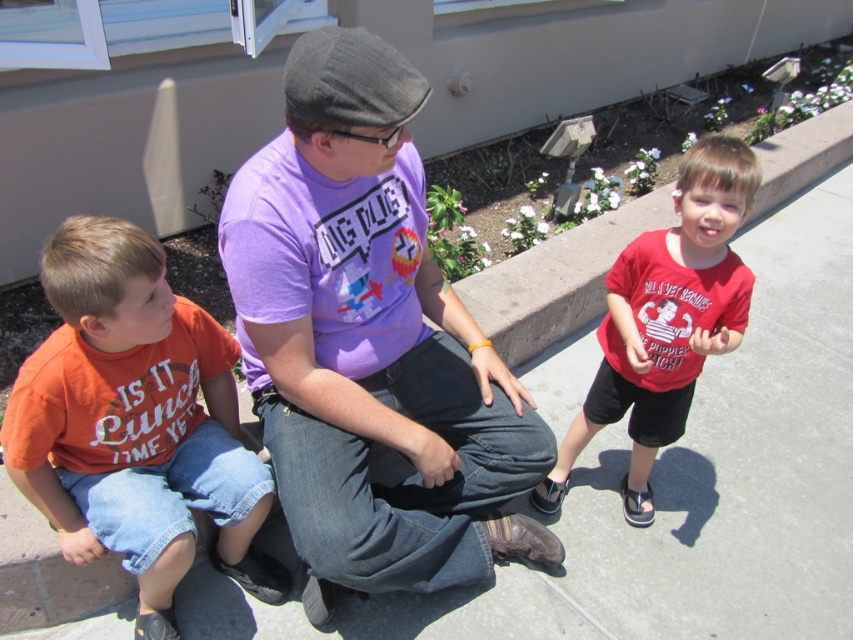
You are a photographer trying to capture a group photo of the purple cotton shirt at center and the red matte shirt at right. Since you want both subjects to be centered in the frame, which direction should you move the camera to align them properly?

The purple cotton shirt at center is positioned on the left side of red matte shirt at right, so to center them both in the frame, you should move the camera slightly to the left to shift the focus towards the purple cotton shirt at center.

You are a photographer trying to capture a group photo of the orange cotton shirt at left and the red matte shirt at right. Since you want both subjects to be clearly visible in the photo, which one should you focus on first to ensure the foreground is sharp?

The orange cotton shirt at left should be focused on first because it is in front of the red matte shirt at right, ensuring the foreground is sharp.